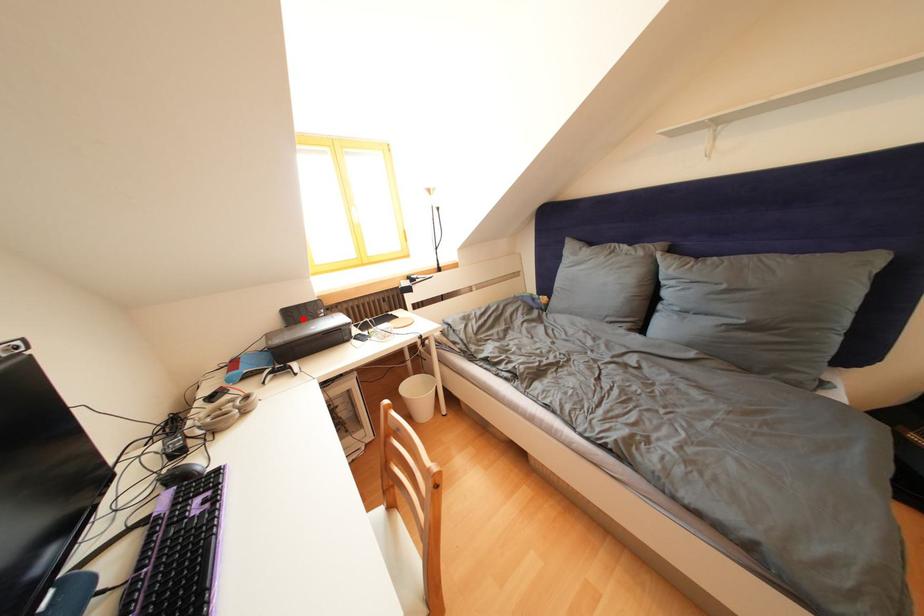
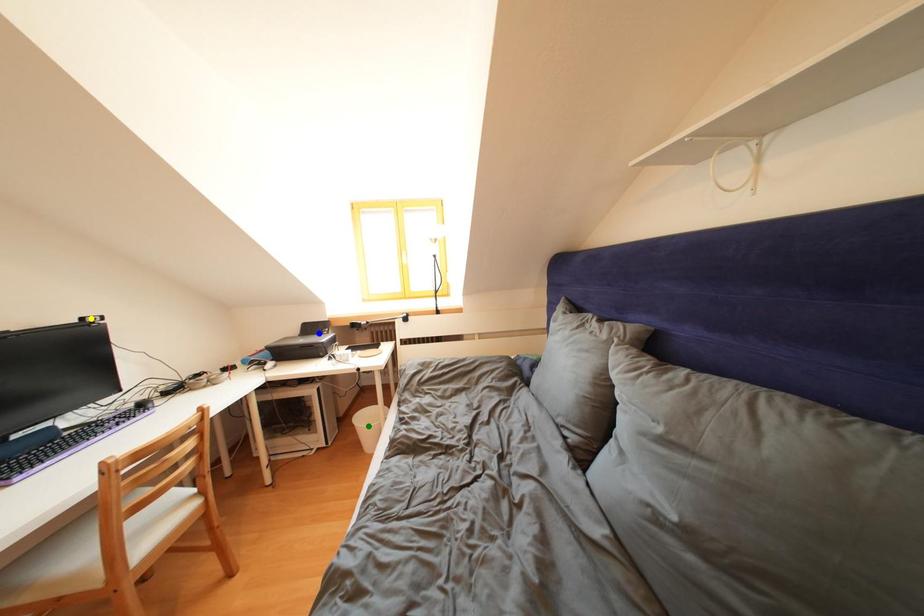
Question: I am providing you with two images of the same scene from different viewpoints. A red point is marked on the first image. You are given multiple points on the second image. Which mark in image 2 goes with the point in image 1?

Choices:
 (A) blue point
 (B) yellow point
 (C) green point

Answer: (A)